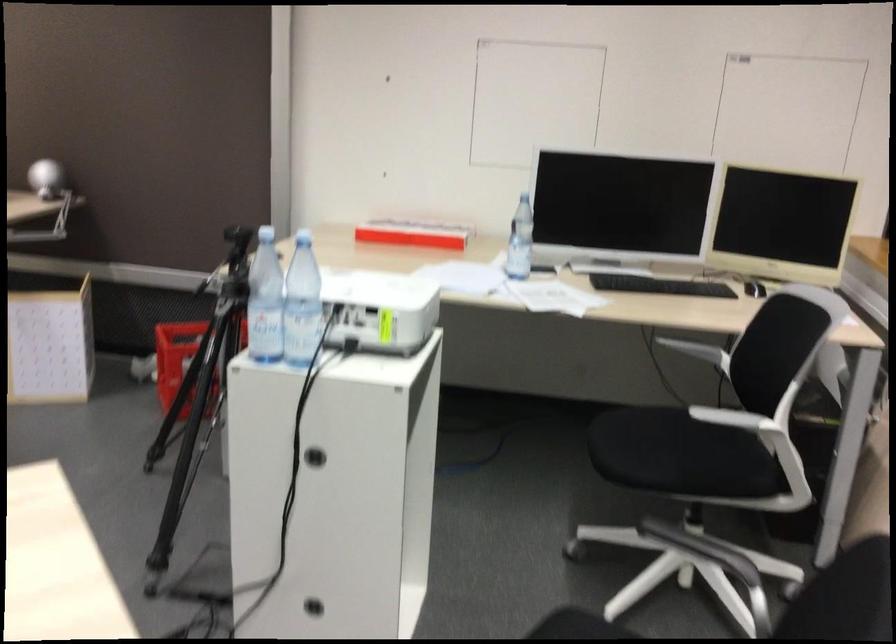
The location [179,359] corresponds to which object?

This point indicates the red plastic crate.